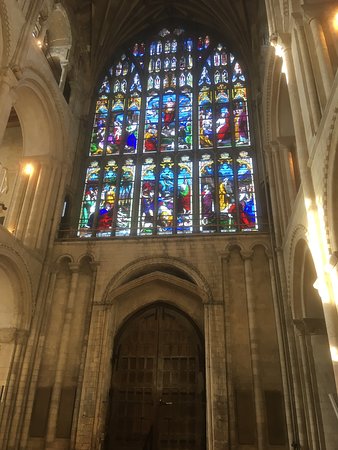
Identify the location of wall. (101, 264).